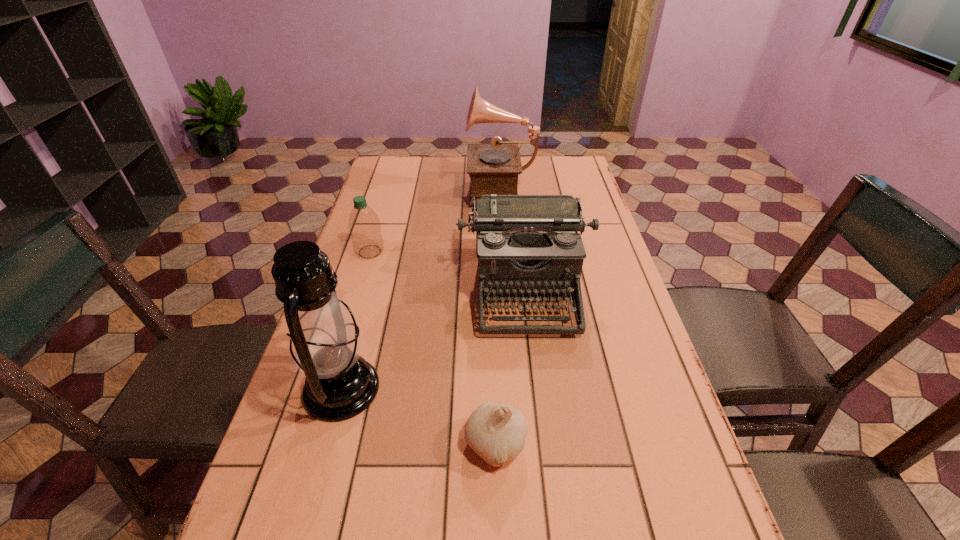
You are a GUI agent. You are given a task and a screenshot of the screen. Output one action in this format:
    pyautogui.click(x=<x>, y=<y>)
    Task: Click on the farthest object
    
    Given the screenshot: What is the action you would take?
    pyautogui.click(x=493, y=169)

Locate an element on the screen. The width and height of the screenshot is (960, 540). oil lamp is located at coordinates [x=325, y=343].

Locate an element on the screen. the third tallest object is located at coordinates (525, 244).

The height and width of the screenshot is (540, 960). Identify the location of the fourth tallest object. (364, 225).

Where is `the shortest object`? The height and width of the screenshot is (540, 960). the shortest object is located at coordinates (496, 431).

Where is `vacant region located 0.200m on the horn of the farthest object`? vacant region located 0.200m on the horn of the farthest object is located at coordinates (412, 188).

Find the location of a particular element. This screenshot has width=960, height=540. vacant area situated on the horn of the farthest object is located at coordinates (403, 188).

Image resolution: width=960 pixels, height=540 pixels. Find the location of `vacant space located 0.180m on the horn of the farthest object`. vacant space located 0.180m on the horn of the farthest object is located at coordinates (417, 188).

Find the location of `vacant space located 0.110m on the back of the oil lamp`. vacant space located 0.110m on the back of the oil lamp is located at coordinates (361, 319).

The width and height of the screenshot is (960, 540). Identify the location of free space located on the typing side of the third tallest object. (540, 418).